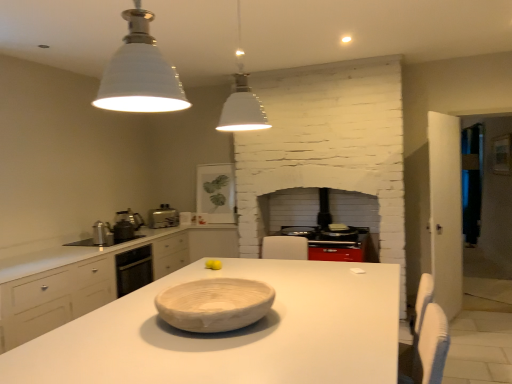
Question: From the image's perspective, is white matte pendant light at upper center, the 1th light fixture when ordered from back to front, on top of white matte countertop at center?

Choices:
 (A) no
 (B) yes

Answer: (B)

Question: From the image's perspective, does white matte pendant light at upper center, arranged as the second light fixture when viewed from the front, appear lower than white matte countertop at center?

Choices:
 (A) no
 (B) yes

Answer: (A)

Question: Is white matte pendant light at upper center, the 1th light fixture when ordered from back to front, shorter than white matte countertop at center?

Choices:
 (A) no
 (B) yes

Answer: (B)

Question: Is white matte pendant light at upper center, the 1th light fixture when ordered from back to front, not inside white matte countertop at center?

Choices:
 (A) no
 (B) yes

Answer: (B)

Question: Considering the relative positions of white matte pendant light at upper center, arranged as the second light fixture when viewed from the front, and white matte countertop at center in the image provided, is white matte pendant light at upper center, arranged as the second light fixture when viewed from the front, behind white matte countertop at center?

Choices:
 (A) yes
 (B) no

Answer: (A)

Question: Is white matte countertop at center at the back of white matte pendant light at upper center, arranged as the second light fixture when viewed from the front?

Choices:
 (A) no
 (B) yes

Answer: (A)

Question: From the image's perspective, is white ceramic light fixture at upper center, which is counted as the second light fixture, starting from the back, over yellow matte tennis ball at center?

Choices:
 (A) no
 (B) yes

Answer: (B)

Question: Is white ceramic light fixture at upper center, which is counted as the second light fixture, starting from the back, with yellow matte tennis ball at center?

Choices:
 (A) no
 (B) yes

Answer: (A)

Question: Is white ceramic light fixture at upper center, which is counted as the second light fixture, starting from the back, looking in the opposite direction of yellow matte tennis ball at center?

Choices:
 (A) no
 (B) yes

Answer: (A)

Question: From a real-world perspective, is white ceramic light fixture at upper center, which is counted as the second light fixture, starting from the back, over yellow matte tennis ball at center?

Choices:
 (A) no
 (B) yes

Answer: (B)

Question: Does white ceramic light fixture at upper center, which appears as the first light fixture when viewed from the front, have a larger size compared to yellow matte tennis ball at center?

Choices:
 (A) yes
 (B) no

Answer: (A)

Question: Would you say white ceramic light fixture at upper center, which is counted as the second light fixture, starting from the back, is outside yellow matte tennis ball at center?

Choices:
 (A) no
 (B) yes

Answer: (B)

Question: Does metallic silver kettle at left, the second appliance when ordered from front to back, come behind matte white framed picture at upper center, which is the 1th appliance from back to front?

Choices:
 (A) yes
 (B) no

Answer: (B)